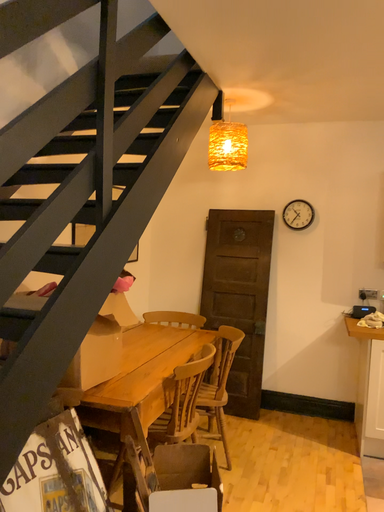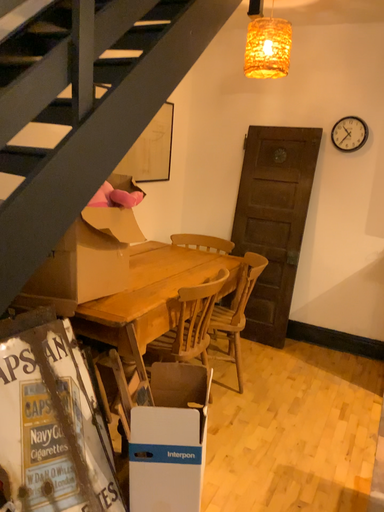
Question: How did the camera likely rotate when shooting the video?

Choices:
 (A) rotated right
 (B) rotated left

Answer: (B)